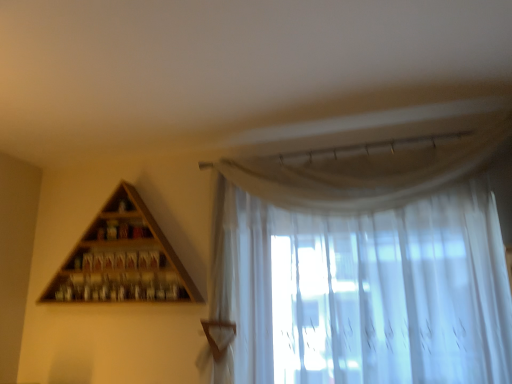
Find the location of `sheer white curtain at upper right`. sheer white curtain at upper right is located at coordinates (360, 268).

The height and width of the screenshot is (384, 512). What do you see at coordinates (360, 268) in the screenshot? I see `sheer white curtain at upper right` at bounding box center [360, 268].

Measure the distance between wooden triangle at upper left and camera.

wooden triangle at upper left is 2.21 meters away from camera.

The image size is (512, 384). Describe the element at coordinates (122, 259) in the screenshot. I see `wooden triangle at upper left` at that location.

This screenshot has width=512, height=384. What are the coordinates of `wooden triangle at upper left` in the screenshot? It's located at (122, 259).

At what (x,y) coordinates should I click in order to perform the action: click on sheer white curtain at upper right. Please return your answer as a coordinate pair (x, y). This screenshot has width=512, height=384. Looking at the image, I should click on (360, 268).

In the scene shown: Does wooden triangle at upper left appear on the left side of sheer white curtain at upper right?

Correct, you'll find wooden triangle at upper left to the left of sheer white curtain at upper right.

Does wooden triangle at upper left come in front of sheer white curtain at upper right?

That is False.

Does point (169, 286) come closer to viewer compared to point (259, 301)?

No, (169, 286) is behind (259, 301).

From the image's perspective, is wooden triangle at upper left on top of sheer white curtain at upper right?

Actually, wooden triangle at upper left appears below sheer white curtain at upper right in the image.

From a real-world perspective, between wooden triangle at upper left and sheer white curtain at upper right, who is vertically higher?

From a 3D spatial view, wooden triangle at upper left is above.

Is wooden triangle at upper left thinner than sheer white curtain at upper right?

Yes.

Who is taller, wooden triangle at upper left or sheer white curtain at upper right?

Standing taller between the two is sheer white curtain at upper right.

Does wooden triangle at upper left have a smaller size compared to sheer white curtain at upper right?

Correct, wooden triangle at upper left occupies less space than sheer white curtain at upper right.

Is wooden triangle at upper left inside the boundaries of sheer white curtain at upper right, or outside?

wooden triangle at upper left is not inside sheer white curtain at upper right, it's outside.

Is wooden triangle at upper left not near sheer white curtain at upper right?

No, wooden triangle at upper left is not far away from sheer white curtain at upper right.

Is sheer white curtain at upper right at the back of wooden triangle at upper left?

No, wooden triangle at upper left's orientation is not away from sheer white curtain at upper right.

How many degrees apart are the facing directions of wooden triangle at upper left and sheer white curtain at upper right?

There is a 0.386-degree angle between the facing directions of wooden triangle at upper left and sheer white curtain at upper right.

Where is `curtain in front of the wooden triangle at upper left`? curtain in front of the wooden triangle at upper left is located at coordinates (360, 268).

Which is more to the left, sheer white curtain at upper right or wooden triangle at upper left?

From the viewer's perspective, wooden triangle at upper left appears more on the left side.

Which is in front, sheer white curtain at upper right or wooden triangle at upper left?

sheer white curtain at upper right is closer to the camera.

Which point is more forward, (449, 254) or (167, 287)?

Positioned in front is point (449, 254).

From the image's perspective, would you say sheer white curtain at upper right is shown under wooden triangle at upper left?

Incorrect, from the image's perspective, sheer white curtain at upper right is higher than wooden triangle at upper left.

From a real-world perspective, is sheer white curtain at upper right positioned under wooden triangle at upper left based on gravity?

Yes, from a real-world perspective, sheer white curtain at upper right is under wooden triangle at upper left.

Does sheer white curtain at upper right have a greater width compared to wooden triangle at upper left?

Indeed, sheer white curtain at upper right has a greater width compared to wooden triangle at upper left.

From their relative heights in the image, would you say sheer white curtain at upper right is taller or shorter than wooden triangle at upper left?

Considering their sizes, sheer white curtain at upper right has more height than wooden triangle at upper left.

Does sheer white curtain at upper right have a larger size compared to wooden triangle at upper left?

Correct, sheer white curtain at upper right is larger in size than wooden triangle at upper left.

Is sheer white curtain at upper right not inside wooden triangle at upper left?

Indeed, sheer white curtain at upper right is completely outside wooden triangle at upper left.

Is sheer white curtain at upper right positioned far away from wooden triangle at upper left?

They are positioned close to each other.

Could you tell me if sheer white curtain at upper right is turned towards wooden triangle at upper left?

No, sheer white curtain at upper right is not facing towards wooden triangle at upper left.

This screenshot has height=384, width=512. Identify the location of shelf below the sheer white curtain at upper right (from the image's perspective). (122, 259).

At what (x,y) coordinates should I click in order to perform the action: click on curtain on the right of wooden triangle at upper left. Please return your answer as a coordinate pair (x, y). This screenshot has height=384, width=512. Looking at the image, I should click on (360, 268).

Where is `curtain above the wooden triangle at upper left (from the image's perspective)`? curtain above the wooden triangle at upper left (from the image's perspective) is located at coordinates (360, 268).